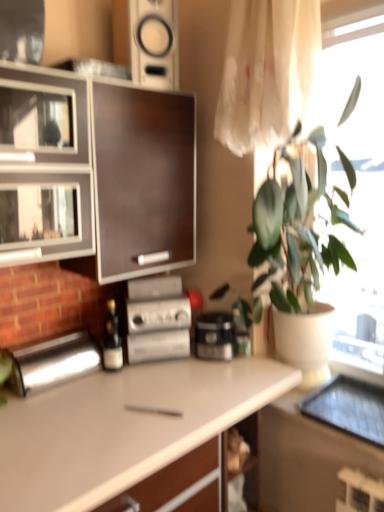
Question: Looking at the image, does white matte countertop at center seem bigger or smaller compared to translucent white curtain at upper right?

Choices:
 (A) small
 (B) big

Answer: (B)

Question: Looking at their shapes, would you say white matte countertop at center is wider or thinner than translucent white curtain at upper right?

Choices:
 (A) wide
 (B) thin

Answer: (A)

Question: Which object is the farthest from the translucent white curtain at upper right?

Choices:
 (A) polished stainless steel bread bin at left, the 2th appliance positioned from the right
 (B) white glossy speaker at upper center
 (C) green matte plant at upper right
 (D) dark wood cabinet at left
 (E) black plastic coffee maker at center

Answer: (A)

Question: Which object is positioned closest to the white matte countertop at center?

Choices:
 (A) silver metallic stereo at center, acting as the 2th appliance starting from the left
 (B) wooden shelf at lower center
 (C) green matte plant at upper right
 (D) white glossy speaker at upper center
 (E) black plastic coffee maker at center

Answer: (A)